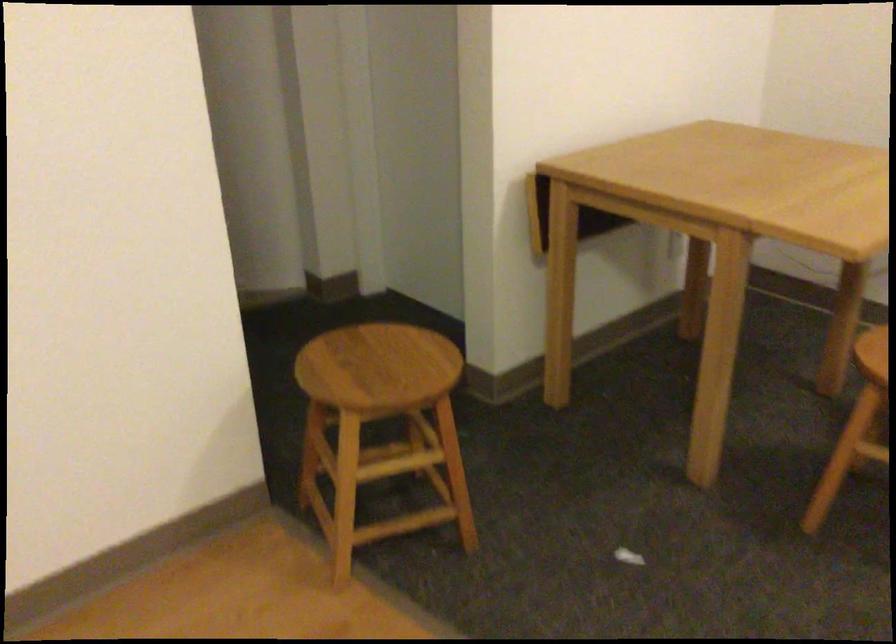
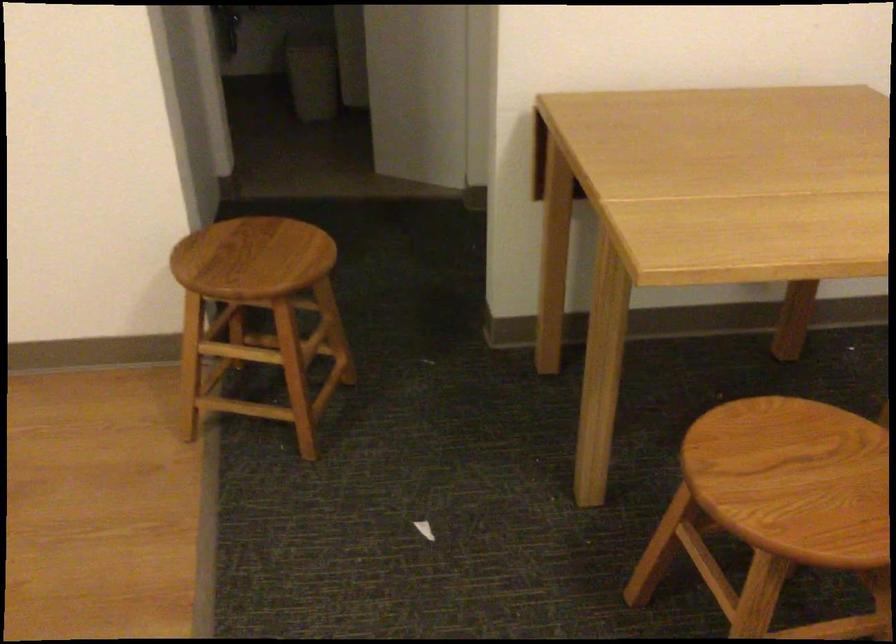
Find the pixel in the second image that matches pixel 366 363 in the first image.

(255, 252)